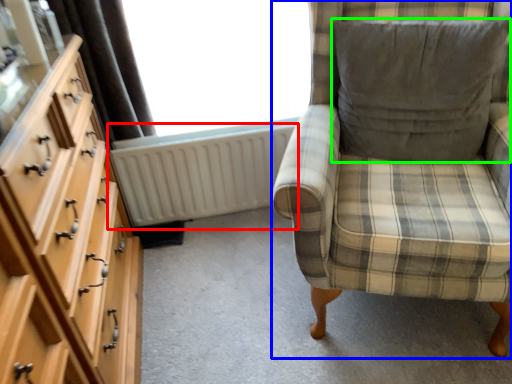
Question: Estimate the real-world distances between objects in this image. Which object is closer to radiator (highlighted by a red box), furniture (highlighted by a blue box) or pillow (highlighted by a green box)?

Choices:
 (A) furniture
 (B) pillow

Answer: (B)